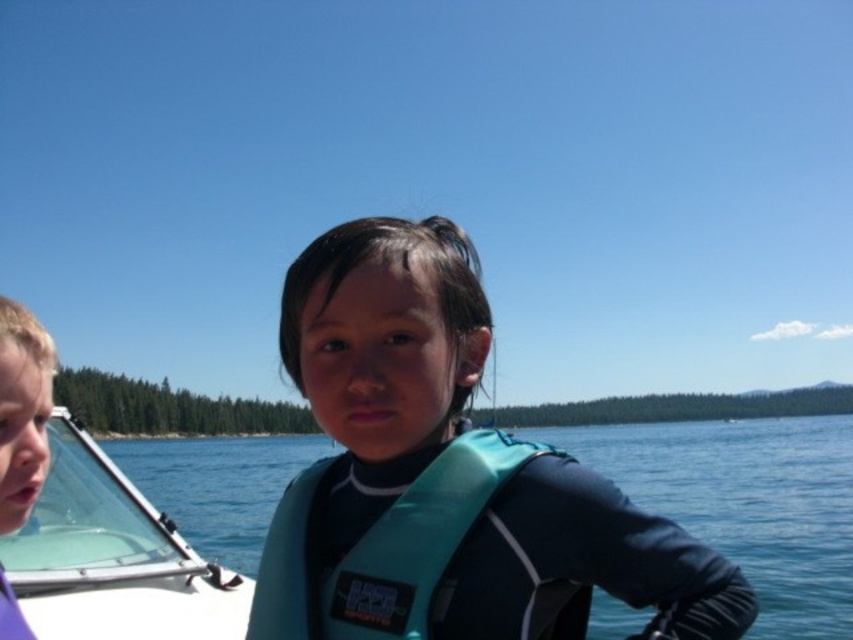
You are a swimmer wearing the teal fabric life jacket at center. You want to get to the transparent plastic boat at lower left. Which direction should you swim to reach it?

The transparent plastic boat at lower left is located below the teal fabric life jacket at center, so you should swim downward to reach it.

You are a photographer trying to capture both the teal fabric life vest at center and the matte purple shirt at left in the same frame. Based on their positions, which object should you focus on first to ensure both are in focus?

The teal fabric life vest at center is in front of the matte purple shirt at left, so you should focus on the teal fabric life vest at center first to ensure both are in focus.